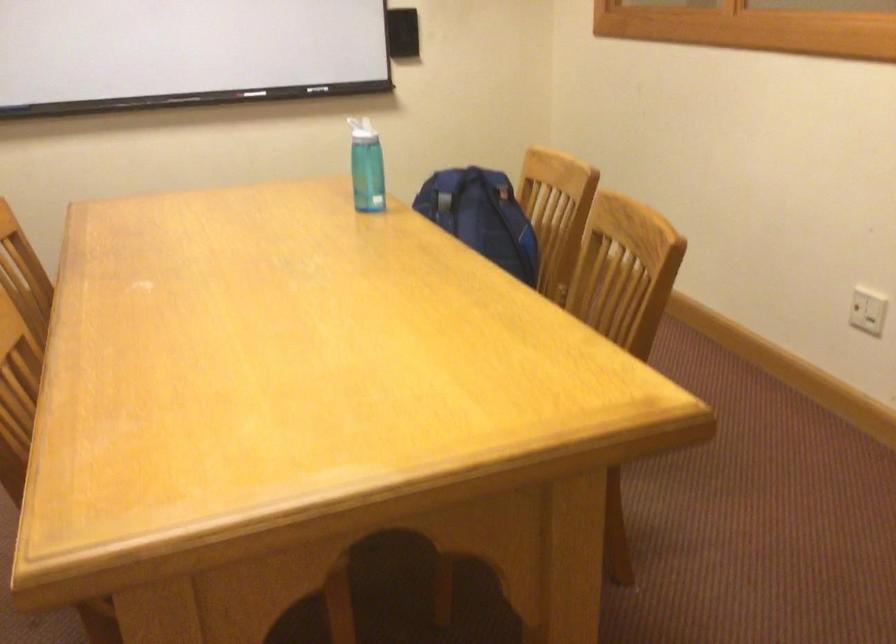
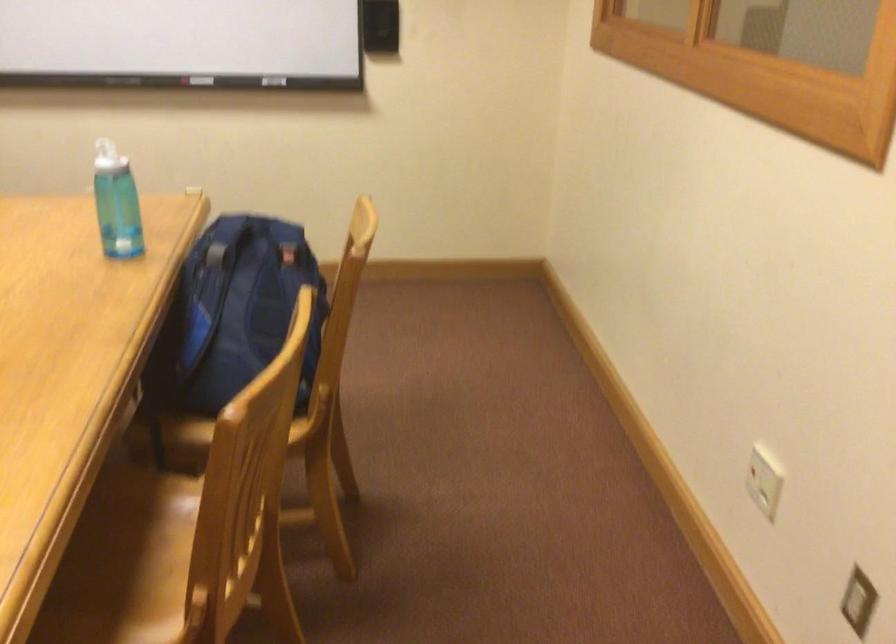
Question: I am providing you with two images of the same scene from different viewpoints. After the viewpoint changes to image2, which objects are now occluded?

Choices:
 (A) white bottle lid
 (B) yellow jar
 (C) blue water bottle
 (D) backpack top handle

Answer: (A)